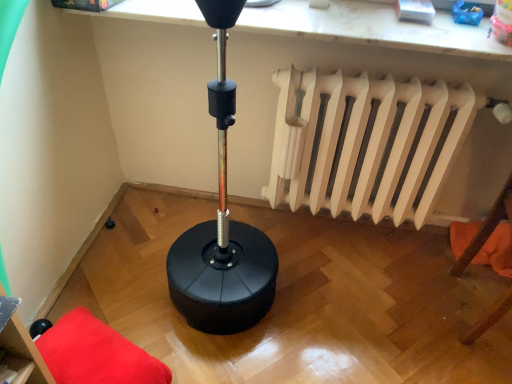
Question: Is velvet red cushion at lower left, positioned as the 1th furniture in bottom-to-top order, bigger than orange fabric pillow at lower right?

Choices:
 (A) yes
 (B) no

Answer: (A)

Question: Are velvet red cushion at lower left, positioned as the 1th furniture in bottom-to-top order, and orange fabric pillow at lower right making contact?

Choices:
 (A) no
 (B) yes

Answer: (A)

Question: Is velvet red cushion at lower left, which is the second furniture from front to back, positioned in front of orange fabric pillow at lower right?

Choices:
 (A) no
 (B) yes

Answer: (B)

Question: From the image's perspective, is velvet red cushion at lower left, placed as the 1th furniture when sorted from back to front, located above orange fabric pillow at lower right?

Choices:
 (A) no
 (B) yes

Answer: (A)

Question: From a real-world perspective, is velvet red cushion at lower left, positioned as the 1th furniture in bottom-to-top order, located higher than orange fabric pillow at lower right?

Choices:
 (A) yes
 (B) no

Answer: (B)

Question: Does velvet red cushion at lower left, which is the second furniture from front to back, come behind orange fabric pillow at lower right?

Choices:
 (A) no
 (B) yes

Answer: (A)

Question: Is orange fabric pillow at lower right to the left of black rubber punching bag at upper center from the viewer's perspective?

Choices:
 (A) no
 (B) yes

Answer: (A)

Question: From a real-world perspective, does orange fabric pillow at lower right sit lower than black rubber punching bag at upper center?

Choices:
 (A) yes
 (B) no

Answer: (A)

Question: Can you confirm if orange fabric pillow at lower right is shorter than black rubber punching bag at upper center?

Choices:
 (A) yes
 (B) no

Answer: (B)

Question: Does orange fabric pillow at lower right have a larger size compared to black rubber punching bag at upper center?

Choices:
 (A) yes
 (B) no

Answer: (B)

Question: Is orange fabric pillow at lower right not close to black rubber punching bag at upper center?

Choices:
 (A) no
 (B) yes

Answer: (A)

Question: Considering the relative sizes of orange fabric pillow at lower right and black rubber punching bag at upper center in the image provided, is orange fabric pillow at lower right taller than black rubber punching bag at upper center?

Choices:
 (A) no
 (B) yes

Answer: (B)

Question: Is black rubber punching bag at upper center taller than matte black stool at lower left, the second furniture in the back-to-front sequence?

Choices:
 (A) yes
 (B) no

Answer: (A)